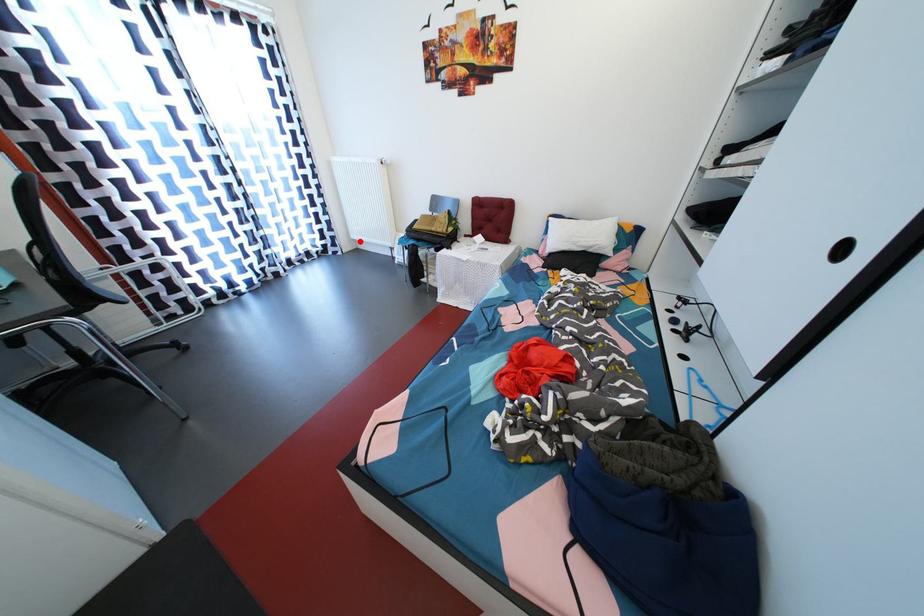
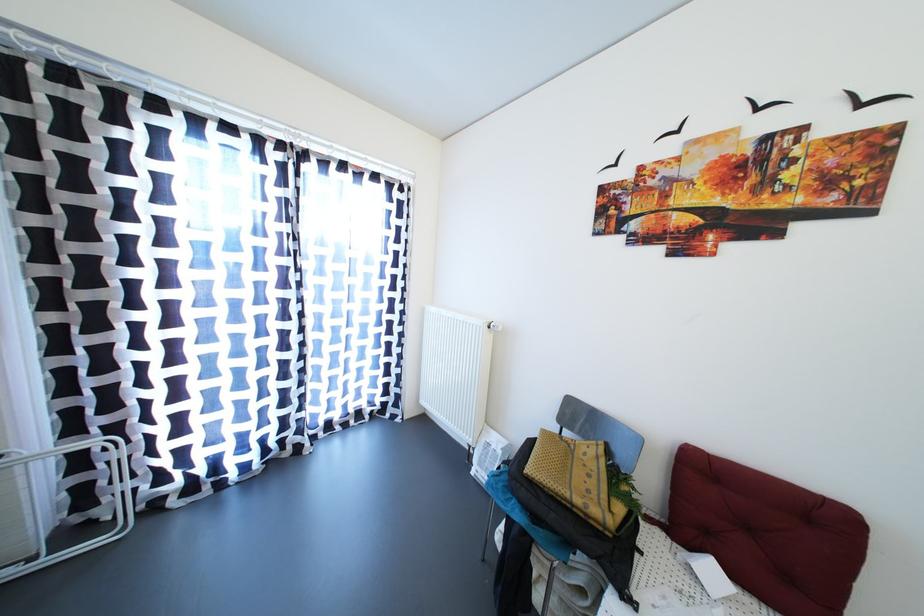
Locate, in the second image, the point that corresponds to the highlighted location in the first image.

(430, 407)